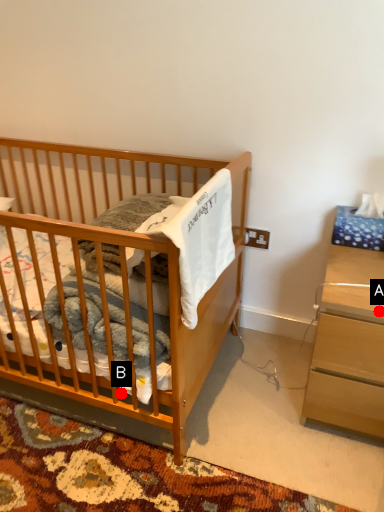
Question: Two points are circled on the image, labeled by A and B beside each circle. Which point appears farthest from the camera in this image?

Choices:
 (A) A is further
 (B) B is further

Answer: (B)